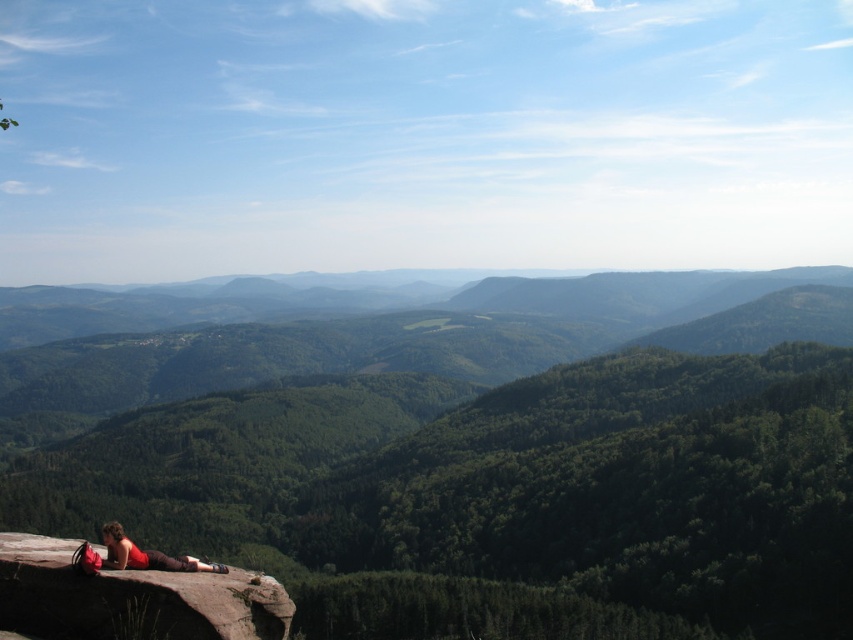
You are a hiker who wants to reach the brown rough cliff at lower left. Based on the scene description, what is the direction you should head from your current position at point [131,598]?

The brown rough cliff at lower left is located at point [131,598], so you are already at the desired location.

You are a hiker who wants to take a photo of the matte red shirt at lower left and the brown rough cliff at lower left. Which object should you focus on first if you want to capture both in the same frame without moving the camera?

You should focus on the brown rough cliff at lower left first because it is taller than the matte red shirt at lower left, allowing both to be in focus when using depth of field techniques.